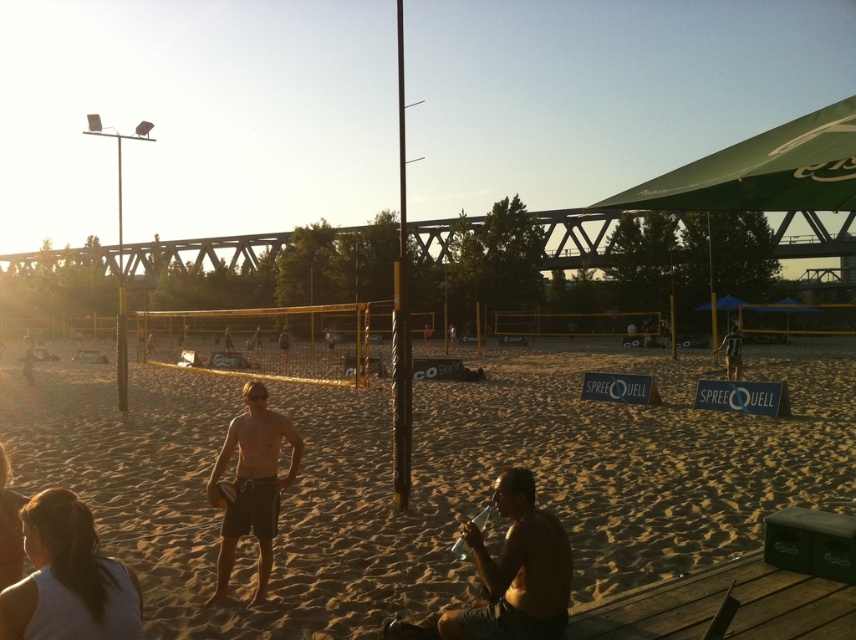
Question: In this image, where is matte gray shorts at center located relative to yellow matte volleyball at center?

Choices:
 (A) right
 (B) left

Answer: (A)

Question: Among these objects, which one is nearest to the camera?

Choices:
 (A) yellow matte volleyball at center
 (B) shiny metallic can at lower center
 (C) matte gray shorts at center
 (D) light brown wooden pole at center

Answer: (B)

Question: Which point appears closest to the camera in this image?

Choices:
 (A) (215, 502)
 (B) (522, 595)
 (C) (224, 531)
 (D) (734, 365)

Answer: (B)

Question: Is brown sandy beach at center wider than matte gray shorts at center?

Choices:
 (A) no
 (B) yes

Answer: (B)

Question: Does brown sandy beach at center lie behind yellow matte volleyball at center?

Choices:
 (A) yes
 (B) no

Answer: (B)

Question: Which of the following is the closest to the observer?

Choices:
 (A) (431, 401)
 (B) (226, 504)

Answer: (B)